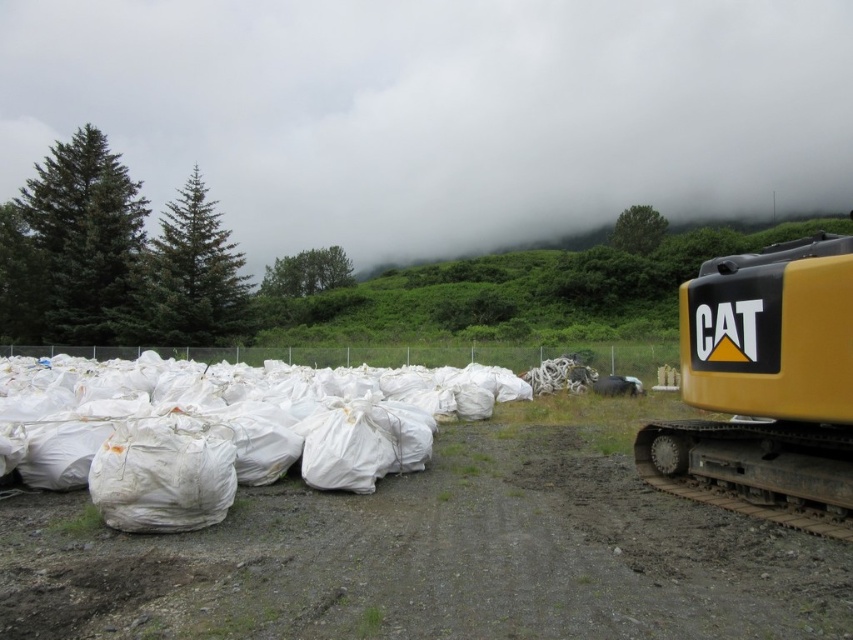
You are a delivery truck driver who needs to turn around your vehicle in the area shown in the image. Based on the scene, which location would you choose between the dull brown dirt track at lower center and the white fabric bags at left?

The dull brown dirt track at lower center occupies less space than the white fabric bags at left, so you should choose the dull brown dirt track at lower center for turning around since it requires less area.

You are standing at the point marked by the coordinates point (231, 426) in the image. What object are you facing? Please provide the exact object label from the scene description.

The point (231, 426) corresponds to white fabric bags at left.

You are a delivery truck driver who needs to transport heavy equipment from the construction site to the storage yard. The route requires passing over the dull brown dirt track at lower center and the yellow rubber track at right. Given that the equipment weighs 10 tons, which track should you choose to ensure it can support the weight?

The yellow rubber track at right is longer than the dull brown dirt track at lower center. Since the equipment weighs 10 tons, the longer yellow rubber track at right is more likely to provide sufficient support and stability for the heavy load.